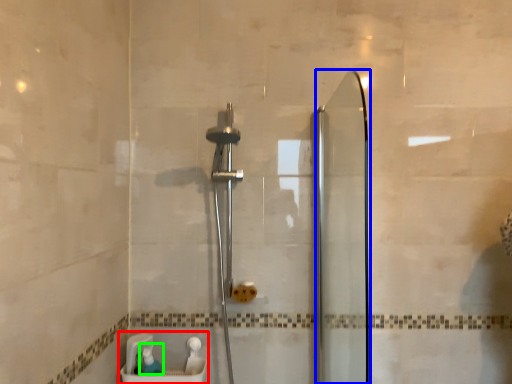
Question: Which object is positioned farthest from sink (highlighted by a red box)? Select from screen door (highlighted by a blue box) and toiletry (highlighted by a green box).

Choices:
 (A) screen door
 (B) toiletry

Answer: (A)